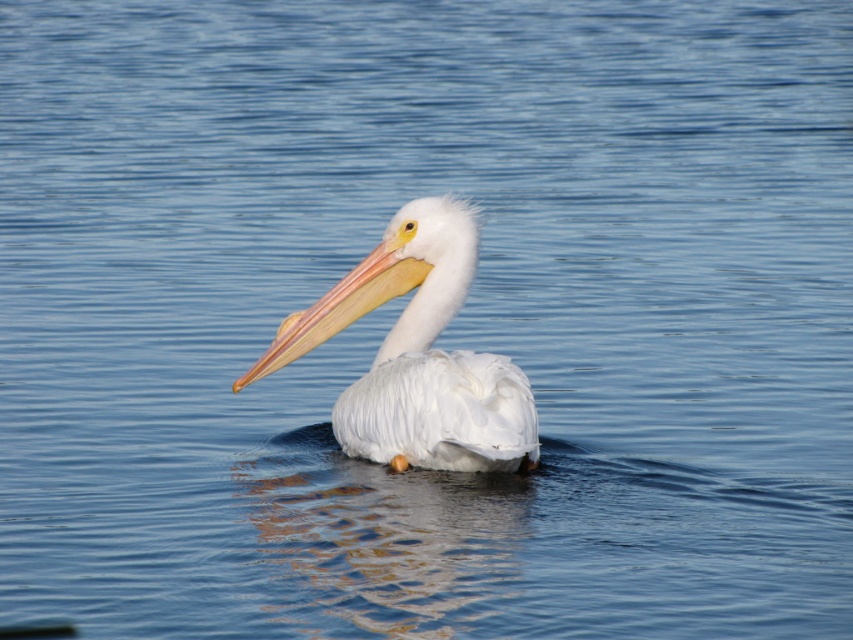
Looking at the image of the pelican on the water, which object takes up more space in the scene? The white feathered pelican at center or the matte orange beak at center?

The white feathered pelican at center is larger in size than the matte orange beak at center, so it takes up more space in the scene.

You are a photographer trying to capture the white feathered pelican at center and the matte orange beak at center in a single shot. Since the camera can only focus on one subject at a time, which object should you focus on first to ensure the other remains in the frame?

The white feathered pelican at center is to the right of matte orange beak at center. Since the pelican is the larger subject and the beak is part of it, focus on the matte orange beak at center first, as it is positioned to the left, ensuring the entire pelican stays within the frame.